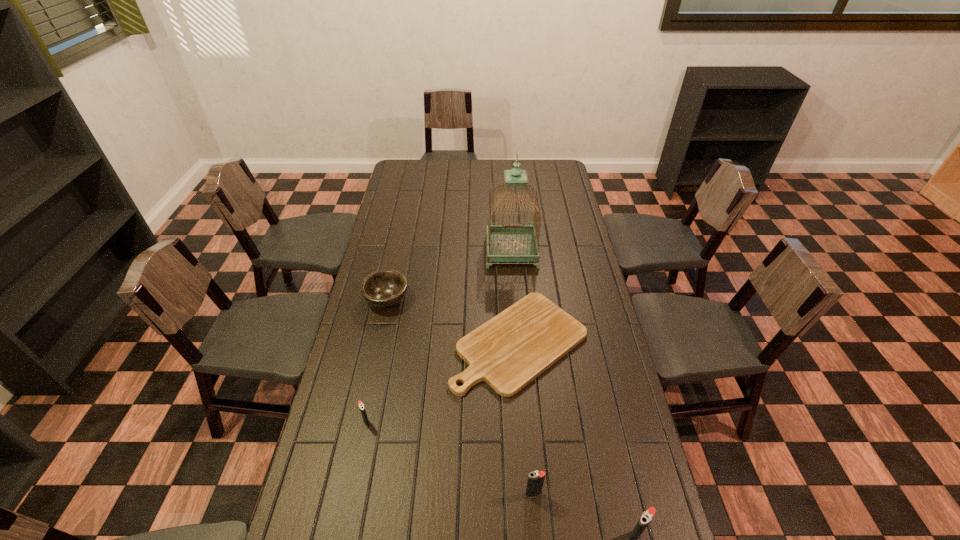
If equal spacing is the goal by inserting an additional igniter among them, please point out a vacant space for this new igniter. Please provide its 2D coordinates. Your answer should be formatted as a tuple, i.e. [(x, y)], where the tuple contains the x and y coordinates of a point satisfying the conditions above.

[(444, 456)]